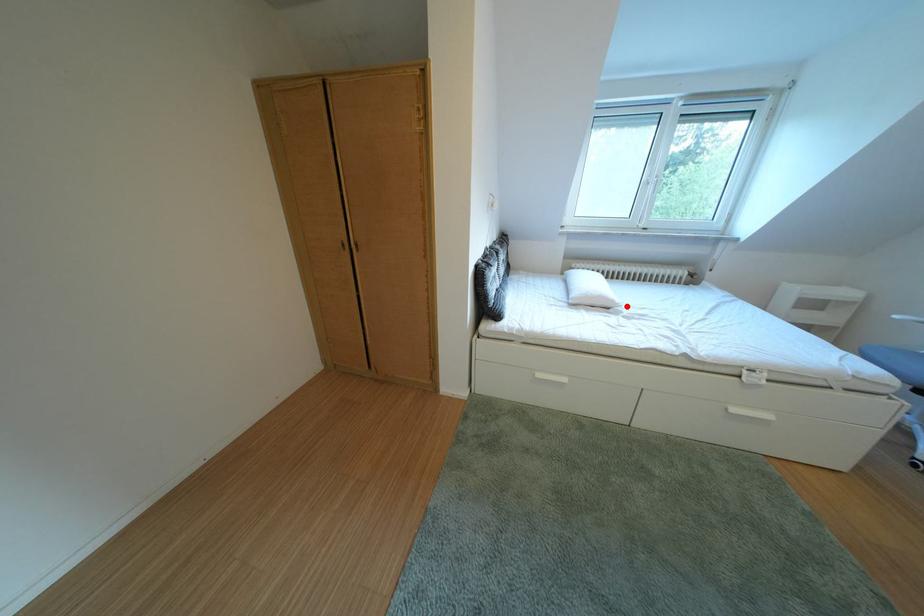
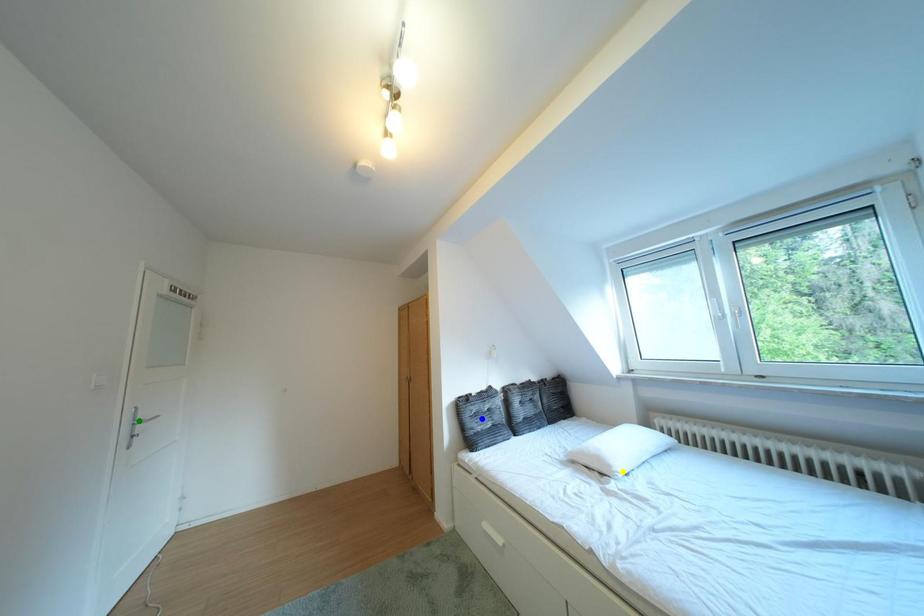
Question: I am providing you with two images of the same scene from different viewpoints. A red point is marked on the first image. You are given multiple points on the second image. Which mark in image 2 goes with the point in image 1?

Choices:
 (A) green point
 (B) yellow point
 (C) blue point

Answer: (B)